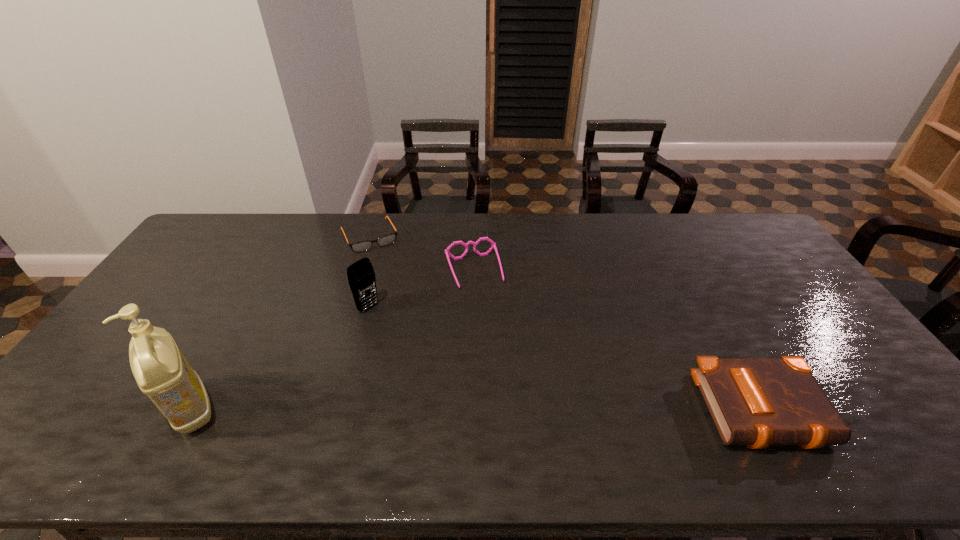
Locate an element on the screen. This screenshot has height=540, width=960. free space located 0.060m on the arms of the second object from right to left is located at coordinates (485, 305).

Where is `vacant space located on the arms of the second object from right to left`? vacant space located on the arms of the second object from right to left is located at coordinates (498, 341).

This screenshot has width=960, height=540. In order to click on vacant space located 0.220m on the arms of the second object from right to left in this screenshot , I will do (x=499, y=344).

This screenshot has height=540, width=960. What are the coordinates of `free location located on the front-facing side of the shortest object` in the screenshot? It's located at (389, 275).

Image resolution: width=960 pixels, height=540 pixels. In order to click on free space located 0.080m on the front-facing side of the shortest object in this screenshot , I will do `click(384, 266)`.

Locate an element on the screen. The image size is (960, 540). free space located on the front-facing side of the shortest object is located at coordinates (405, 310).

You are a GUI agent. You are given a task and a screenshot of the screen. Output one action in this format:
    pyautogui.click(x=<x>, y=<y>)
    Task: Click on the vacant region located on the screen of the third nearest object
    The width and height of the screenshot is (960, 540).
    Given the screenshot: What is the action you would take?
    pyautogui.click(x=413, y=342)

Identify the location of vacant space located 0.230m on the screen of the third nearest object. (428, 354).

Find the location of `vacant space located 0.310m on the screen of the third nearest object`. vacant space located 0.310m on the screen of the third nearest object is located at coordinates coord(448,370).

This screenshot has height=540, width=960. In order to click on object that is at the far edge in this screenshot , I will do `click(361, 246)`.